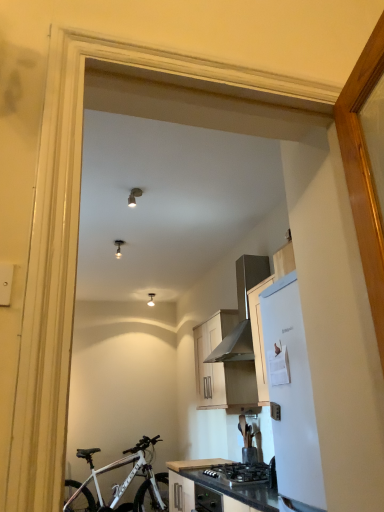
Question: Could you tell me if metallic silver range hood at upper right is facing black granite countertop at lower center?

Choices:
 (A) no
 (B) yes

Answer: (A)

Question: Is metallic silver range hood at upper right beside black granite countertop at lower center?

Choices:
 (A) no
 (B) yes

Answer: (A)

Question: Can you confirm if metallic silver range hood at upper right is taller than black granite countertop at lower center?

Choices:
 (A) no
 (B) yes

Answer: (B)

Question: From the image's perspective, would you say metallic silver range hood at upper right is shown under black granite countertop at lower center?

Choices:
 (A) no
 (B) yes

Answer: (A)

Question: Is black granite countertop at lower center inside metallic silver range hood at upper right?

Choices:
 (A) yes
 (B) no

Answer: (B)

Question: From a real-world perspective, relative to white matte refrigerator at right, is black granite countertop at lower center vertically above or below?

Choices:
 (A) above
 (B) below

Answer: (B)

Question: Considering the relative positions of black granite countertop at lower center and white matte refrigerator at right in the image provided, is black granite countertop at lower center to the left or to the right of white matte refrigerator at right?

Choices:
 (A) right
 (B) left

Answer: (B)

Question: Based on their sizes in the image, would you say black granite countertop at lower center is bigger or smaller than white matte refrigerator at right?

Choices:
 (A) big
 (B) small

Answer: (A)

Question: In terms of width, does black granite countertop at lower center look wider or thinner when compared to white matte refrigerator at right?

Choices:
 (A) thin
 (B) wide

Answer: (B)

Question: Would you say white matte bicycle at lower left is inside or outside white matte refrigerator at right?

Choices:
 (A) outside
 (B) inside

Answer: (A)

Question: From a real-world perspective, is white matte bicycle at lower left positioned above or below white matte refrigerator at right?

Choices:
 (A) below
 (B) above

Answer: (A)

Question: Considering the positions of white matte bicycle at lower left and white matte refrigerator at right in the image, is white matte bicycle at lower left taller or shorter than white matte refrigerator at right?

Choices:
 (A) tall
 (B) short

Answer: (B)

Question: Is white matte bicycle at lower left bigger or smaller than white matte refrigerator at right?

Choices:
 (A) big
 (B) small

Answer: (A)

Question: In the image, is metallic silver range hood at upper right on the left side or the right side of black granite countertop at lower center?

Choices:
 (A) left
 (B) right

Answer: (B)

Question: Is point pyautogui.click(x=264, y=266) closer or farther from the camera than point pyautogui.click(x=246, y=508)?

Choices:
 (A) farther
 (B) closer

Answer: (A)